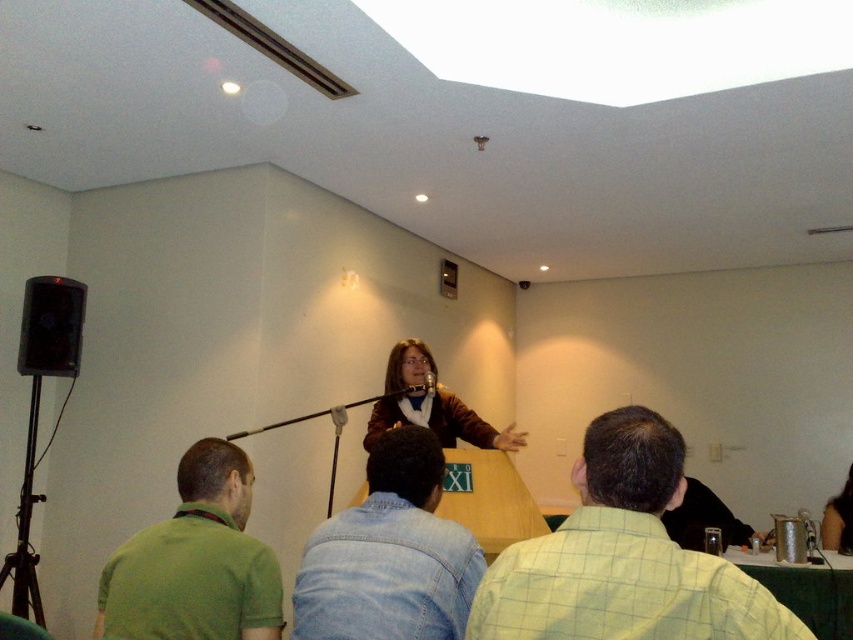
Question: Can you confirm if green checkered shirt at lower right is positioned below green matte shirt at lower left?

Choices:
 (A) yes
 (B) no

Answer: (B)

Question: Which object appears farthest from the camera in this image?

Choices:
 (A) smooth black hair at upper right
 (B) denim jacket at lower center
 (C) green matte shirt at lower left
 (D) brown leather jacket at center

Answer: (A)

Question: Which object appears farthest from the camera in this image?

Choices:
 (A) green checkered shirt at lower right
 (B) smooth black hair at upper right

Answer: (B)

Question: Which of these objects is positioned farthest from the black matte speaker at left?

Choices:
 (A) metallic silver microphone at center
 (B) green checkered shirt at lower right
 (C) smooth black hair at upper right
 (D) brown leather jacket at center

Answer: (C)

Question: Does green checkered shirt at lower right have a smaller size compared to metallic silver microphone at center?

Choices:
 (A) no
 (B) yes

Answer: (A)

Question: Is green checkered shirt at lower right smaller than metallic silver microphone at center?

Choices:
 (A) no
 (B) yes

Answer: (A)